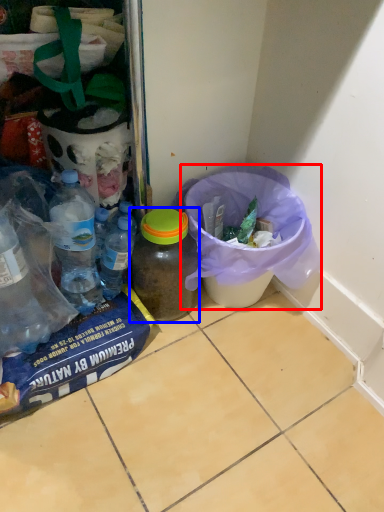
Question: Which object is further to the camera taking this photo, recycling bin (highlighted by a red box) or bottle (highlighted by a blue box)?

Choices:
 (A) recycling bin
 (B) bottle

Answer: (B)